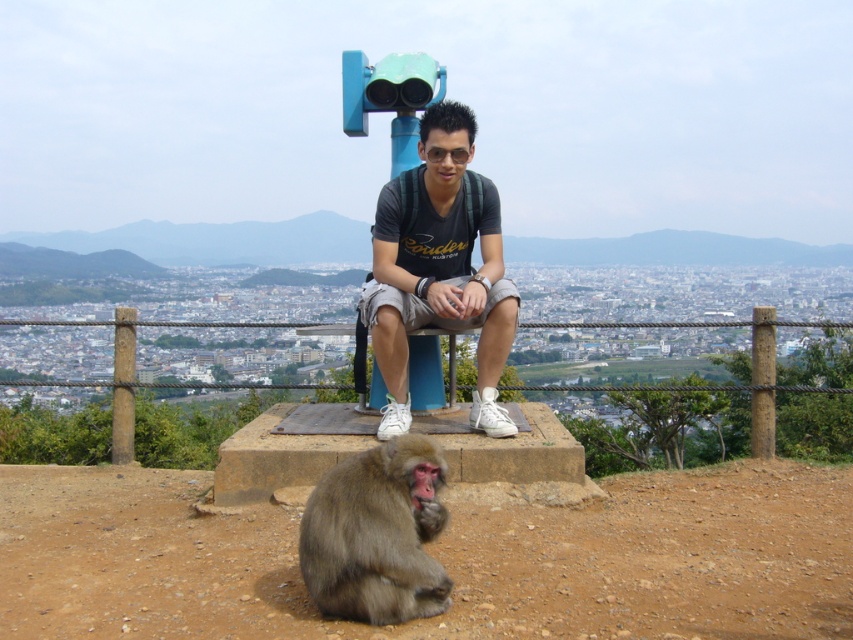
Who is lower down, matte black t-shirt at center or brown furry monkey at lower center?

brown furry monkey at lower center

Locate an element on the screen. The image size is (853, 640). matte black t-shirt at center is located at coordinates (439, 268).

Locate an element on the screen. Image resolution: width=853 pixels, height=640 pixels. matte black t-shirt at center is located at coordinates (439, 268).